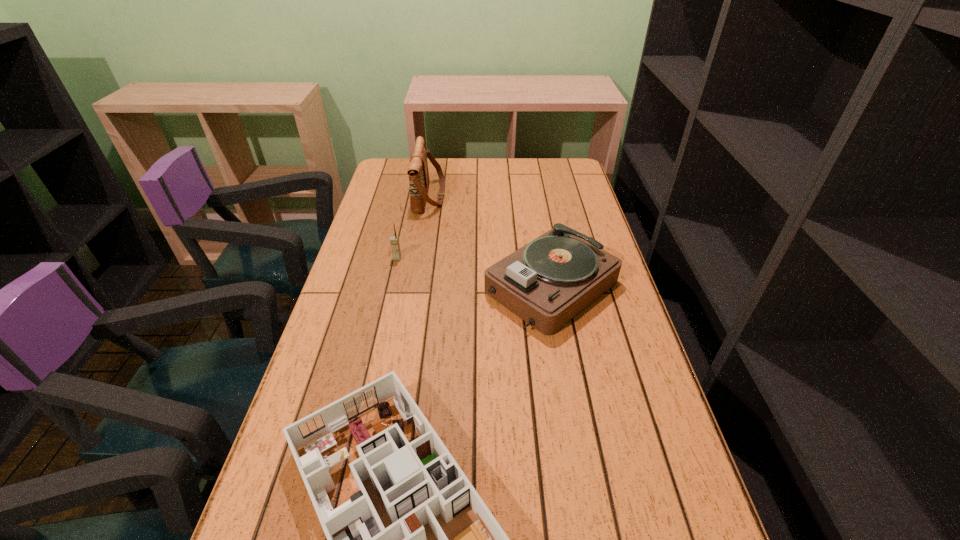
At what (x,y) coordinates should I click in order to perform the action: click on the farthest object. Please return your answer as a coordinate pair (x, y). The height and width of the screenshot is (540, 960). Looking at the image, I should click on (418, 172).

The image size is (960, 540). I want to click on shoulder bag, so click(x=418, y=172).

At what (x,y) coordinates should I click in order to perform the action: click on cellular telephone. Please return your answer as a coordinate pair (x, y). The image size is (960, 540). Looking at the image, I should click on (394, 240).

The image size is (960, 540). In order to click on record player in this screenshot , I will do `click(547, 282)`.

Where is `blank space located on the front-facing side of the farthest object`? This screenshot has width=960, height=540. blank space located on the front-facing side of the farthest object is located at coordinates (459, 197).

The height and width of the screenshot is (540, 960). What are the coordinates of `vacant space located 0.330m on the front of the cellular telephone, where the keypad is located` in the screenshot? It's located at (377, 346).

Where is `free region located 0.300m on the front of the record player`? free region located 0.300m on the front of the record player is located at coordinates (582, 451).

Where is `object located in the far edge section of the desktop`? object located in the far edge section of the desktop is located at coordinates (418, 172).

Identify the location of shoulder bag located at the left edge. (418, 172).

I want to click on cellular telephone located in the left edge section of the desktop, so click(x=394, y=240).